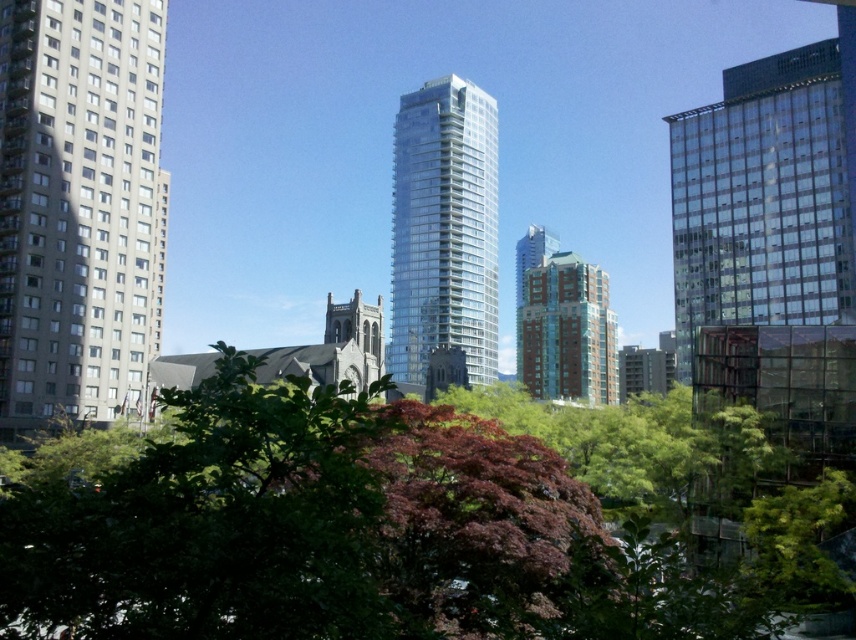
Question: Based on their relative distances, which object is farther from the clear glass tower at center?

Choices:
 (A) clear glass building at upper right
 (B) red brick building at center

Answer: (A)

Question: Does clear glass tower at center have a lesser width compared to teal glass tower at center?

Choices:
 (A) yes
 (B) no

Answer: (B)

Question: Can you confirm if clear glass tower at center is positioned above teal glass tower at center?

Choices:
 (A) no
 (B) yes

Answer: (B)

Question: Which point is closer to the camera?

Choices:
 (A) (102, 1)
 (B) (407, 204)

Answer: (A)

Question: Is clear glass building at upper right thinner than clear glass tower at center?

Choices:
 (A) no
 (B) yes

Answer: (A)

Question: Which point is farther from the camera taking this photo?

Choices:
 (A) (477, 154)
 (B) (593, 390)
 (C) (638, 588)

Answer: (B)